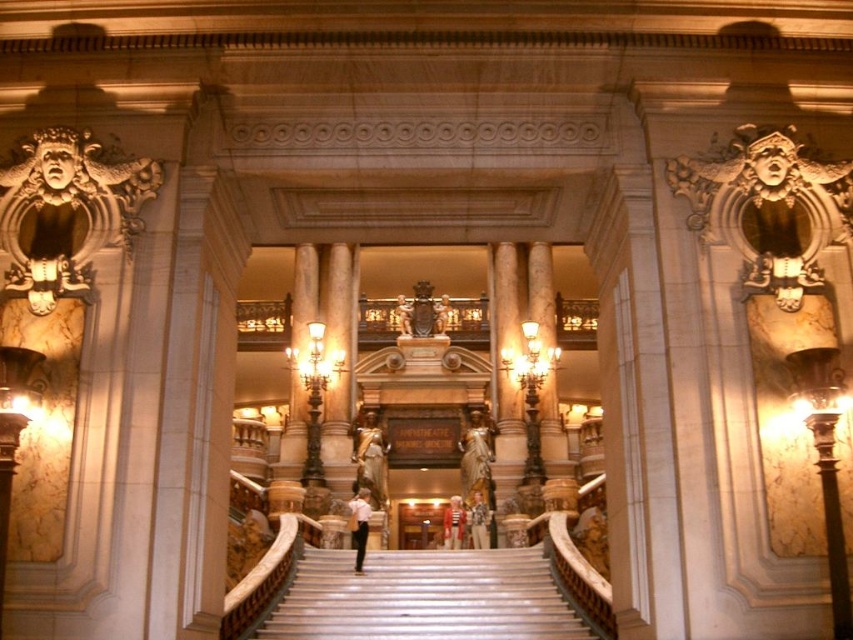
Between point (444, 312) and point (412, 308), which one is positioned behind?

Point (412, 308)

Is matte gold statue at center positioned at the back of bronze statue at center?

Yes, it is.

Which is behind, point (445, 308) or point (403, 333)?

The point (445, 308) is more distant.

Where is `matte gold statue at center`? matte gold statue at center is located at coordinates (440, 316).

Does point (488, 540) come behind point (450, 324)?

That is False.

Does light brown leather jacket at center appear under matte gold statue at center?

Yes.

The height and width of the screenshot is (640, 853). What do you see at coordinates (479, 522) in the screenshot?
I see `light brown leather jacket at center` at bounding box center [479, 522].

This screenshot has height=640, width=853. What are the coordinates of `light brown leather jacket at center` in the screenshot? It's located at (479, 522).

Is white marble stairs at center thinner than white cotton shirt at center?

In fact, white marble stairs at center might be wider than white cotton shirt at center.

Does point (508, 561) come behind point (454, 509)?

No, (508, 561) is in front of (454, 509).

The image size is (853, 640). Find the location of `white marble stairs at center`. white marble stairs at center is located at coordinates (424, 596).